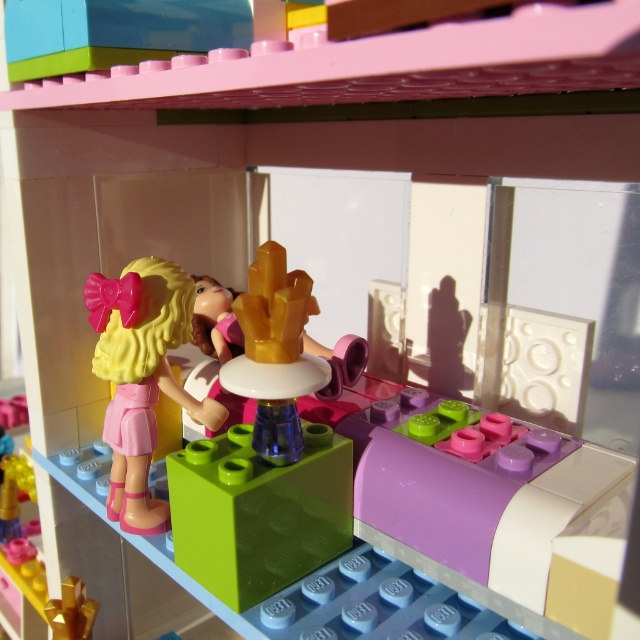
You are a LEGO enthusiast trying to build a structure that requires placing the translucent green block at center on top of the matte pink plastic doll at left. Considering their sizes, will the green block stay balanced on the doll?

The translucent green block at center is larger in size than the matte pink plastic doll at left, so it might not stay balanced because the base of the block is wider than the doll.

Based on the photo, you are holding a small toy that is 10 inches long. You want to place it on the table in the LEGO Friends playset. The table is located at point (259, 499). Can you fit the toy on the table without it hanging off the edge?

The distance of point (259, 499) from the viewer is 21.52 inches. Since the toy is only 10 inches long, it will fit comfortably on the table at that point without overhanging.

You are a small LEGO figure trying to reach the matte pink plastic doll at left from the translucent green block at center. Which direction should you move to get closer to the doll?

Since the translucent green block at center is closer to the viewer than the matte pink plastic doll at left, you should move backward to get closer to the matte pink plastic doll at left.